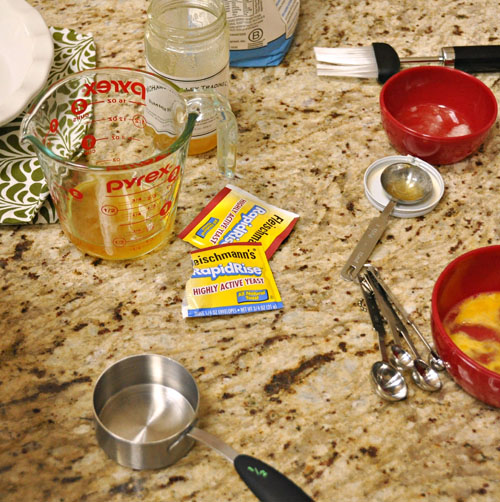
At what (x,y) coordinates should I click in order to perform the action: click on table. Please return your answer as a coordinate pair (x, y). The image size is (500, 502). Looking at the image, I should click on (268, 362).